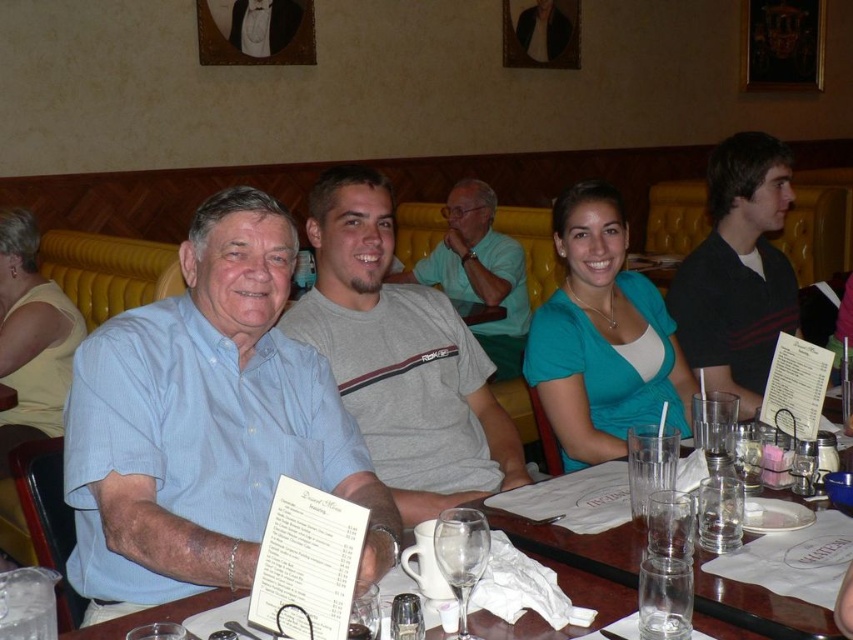
Question: Which of the following is the farthest from the observer?

Choices:
 (A) (445, 314)
 (B) (560, 528)
 (C) (503, 321)

Answer: (C)

Question: Is clear glassware at center smaller than gray cotton t-shirt at center?

Choices:
 (A) no
 (B) yes

Answer: (B)

Question: Can you confirm if light blue shirt at left is positioned to the left of black striped shirt at upper right?

Choices:
 (A) no
 (B) yes

Answer: (B)

Question: Is clear glassware at center above gray cotton t-shirt at center?

Choices:
 (A) yes
 (B) no

Answer: (B)

Question: Considering the real-world distances, which object is farthest from the black striped shirt at upper right?

Choices:
 (A) light blue shirt at left
 (B) light blue shirt at center
 (C) clear glassware at center
 (D) gray cotton t-shirt at center

Answer: (B)

Question: Based on their relative distances, which object is nearer to the light blue shirt at center?

Choices:
 (A) black striped shirt at upper right
 (B) gray cotton t-shirt at center

Answer: (A)